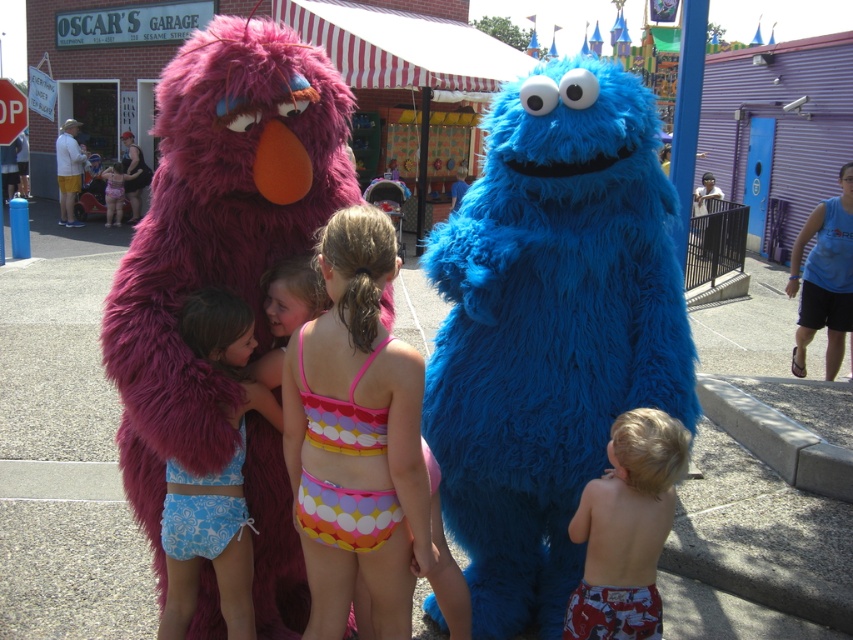
Is polka dot bikini at center wider than blue printed fabric swimsuit at left?

Yes.

This screenshot has width=853, height=640. I want to click on polka dot bikini at center, so click(x=357, y=436).

At what (x,y) coordinates should I click in order to perform the action: click on polka dot bikini at center. Please return your answer as a coordinate pair (x, y). This screenshot has width=853, height=640. Looking at the image, I should click on (357, 436).

Does fuzzy purple monster at center have a greater width compared to printed cotton shorts at lower right?

Correct, the width of fuzzy purple monster at center exceeds that of printed cotton shorts at lower right.

Is fuzzy purple monster at center smaller than printed cotton shorts at lower right?

Actually, fuzzy purple monster at center might be larger than printed cotton shorts at lower right.

This screenshot has height=640, width=853. What do you see at coordinates (218, 236) in the screenshot?
I see `fuzzy purple monster at center` at bounding box center [218, 236].

I want to click on fuzzy purple monster at center, so click(x=218, y=236).

Which of these two, fuzzy purple monster at center or blue printed fabric swimsuit at left, stands taller?

→ Standing taller between the two is fuzzy purple monster at center.

Measure the distance from fuzzy purple monster at center to blue printed fabric swimsuit at left.

9.11 inches

The image size is (853, 640). Find the location of `fuzzy purple monster at center`. fuzzy purple monster at center is located at coordinates point(218,236).